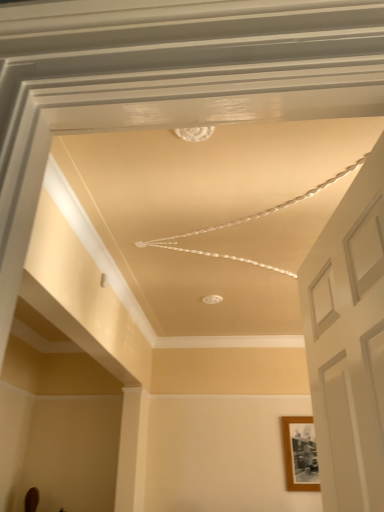
Question: From the image's perspective, relative to wooden photo frame at right, is white matte door at right above or below?

Choices:
 (A) below
 (B) above

Answer: (B)

Question: Is point (311, 330) closer or farther from the camera than point (302, 428)?

Choices:
 (A) closer
 (B) farther

Answer: (A)

Question: Based on their sizes in the image, would you say white matte door at right is bigger or smaller than wooden photo frame at right?

Choices:
 (A) small
 (B) big

Answer: (B)

Question: From a real-world perspective, is wooden photo frame at right positioned above or below white matte door at right?

Choices:
 (A) above
 (B) below

Answer: (B)

Question: Do you think wooden photo frame at right is within white matte door at right, or outside of it?

Choices:
 (A) outside
 (B) inside

Answer: (A)

Question: Considering the positions of wooden photo frame at right and white matte door at right in the image, is wooden photo frame at right bigger or smaller than white matte door at right?

Choices:
 (A) small
 (B) big

Answer: (A)

Question: Does point (283, 445) appear closer or farther from the camera than point (379, 165)?

Choices:
 (A) closer
 (B) farther

Answer: (B)